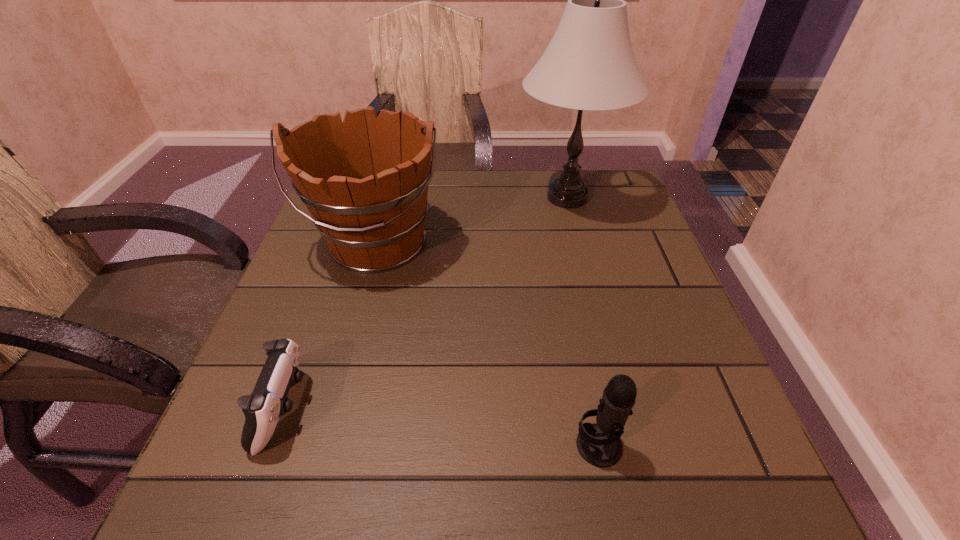
The width and height of the screenshot is (960, 540). Find the location of `vacant area that lies between the second tallest object and the tallest object`. vacant area that lies between the second tallest object and the tallest object is located at coordinates (472, 220).

Identify the location of vacant space that is in between the lamp and the shortest object. The width and height of the screenshot is (960, 540). (426, 303).

This screenshot has height=540, width=960. I want to click on free space between the wine bucket and the tallest object, so click(472, 220).

Locate an element on the screen. Image resolution: width=960 pixels, height=540 pixels. free space between the microphone and the wine bucket is located at coordinates pos(487,345).

In order to click on the closest object to the lamp in this screenshot , I will do `click(365, 181)`.

Identify the location of object that is the closest one to the control. (365, 181).

Locate an element on the screen. vacant space that satisfies the following two spatial constraints: 1. on the front-facing side of the microphone; 2. on the right side of the shortest object is located at coordinates (272, 446).

Where is `free location that satisfies the following two spatial constraints: 1. on the front-facing side of the control; 2. on the right side of the third tallest object`? free location that satisfies the following two spatial constraints: 1. on the front-facing side of the control; 2. on the right side of the third tallest object is located at coordinates click(x=272, y=446).

You are a GUI agent. You are given a task and a screenshot of the screen. Output one action in this format:
    pyautogui.click(x=<x>, y=<y>)
    Task: Click on the vacant space that satisfies the following two spatial constraints: 1. with the handle on the microphone; 2. on the right side of the second tallest object
    The width and height of the screenshot is (960, 540).
    Given the screenshot: What is the action you would take?
    pyautogui.click(x=322, y=446)

Find the location of `free spot that satisfies the following two spatial constraints: 1. on the front-facing side of the microphone; 2. on the right side of the shortest object`. free spot that satisfies the following two spatial constraints: 1. on the front-facing side of the microphone; 2. on the right side of the shortest object is located at coordinates (272, 446).